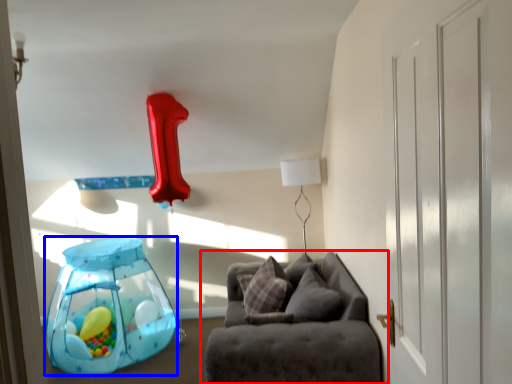
Question: Which object is further to the camera taking this photo, studio couch (highlighted by a red box) or balloon (highlighted by a blue box)?

Choices:
 (A) studio couch
 (B) balloon

Answer: (B)